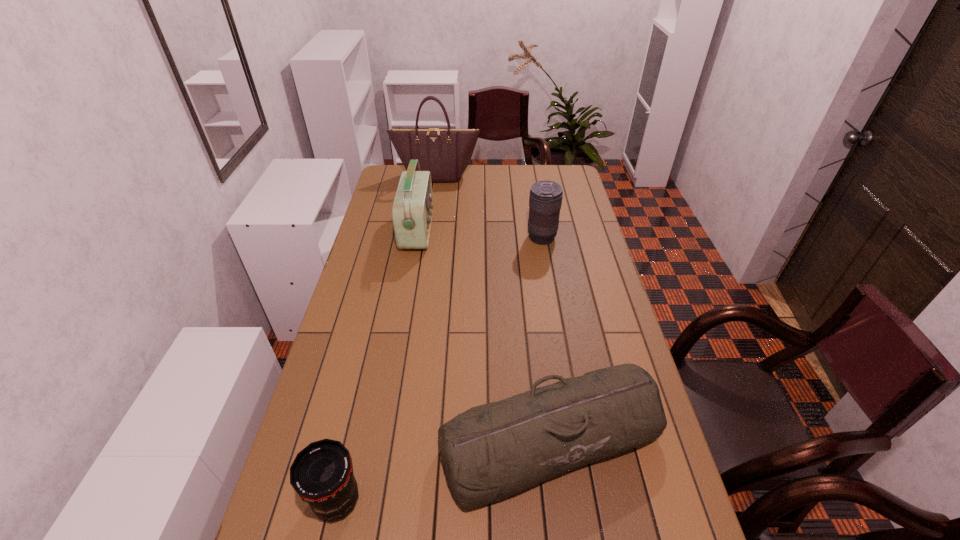
This screenshot has height=540, width=960. In order to click on vacant point located 0.330m on the side of the third shortest object where the control switches are located in this screenshot , I will do `click(443, 238)`.

The width and height of the screenshot is (960, 540). What are the coordinates of `blank area located 0.360m on the side of the third shortest object where the control switches are located` in the screenshot? It's located at (435, 238).

You are a GUI agent. You are given a task and a screenshot of the screen. Output one action in this format:
    pyautogui.click(x=<x>, y=<y>)
    Task: Click on the vacant space located 0.220m on the side of the third shortest object where the control switches are located
    
    Given the screenshot: What is the action you would take?
    pyautogui.click(x=470, y=238)

I want to click on free location located 0.090m on the back of the duffel bag, so click(x=540, y=356).

The image size is (960, 540). Find the location of `free spot located on the back of the nearer telephoto lens`. free spot located on the back of the nearer telephoto lens is located at coordinates (362, 394).

Where is `object at the far edge`? The image size is (960, 540). object at the far edge is located at coordinates (446, 153).

Locate an element on the screen. The image size is (960, 540). handbag located at the left edge is located at coordinates pos(446,153).

The image size is (960, 540). Identify the location of radio receiver at the left edge. (412, 210).

Where is `telephoto lens situated at the left edge`? This screenshot has height=540, width=960. telephoto lens situated at the left edge is located at coordinates (321, 474).

Locate an element on the screen. The height and width of the screenshot is (540, 960). telephoto lens that is at the right edge is located at coordinates (545, 199).